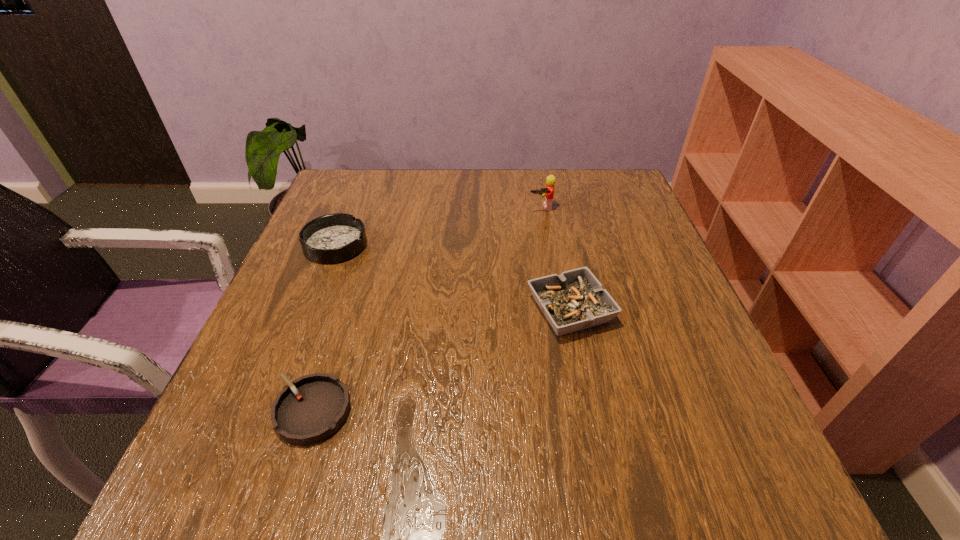
Identify the location of the tallest object. The width and height of the screenshot is (960, 540). (547, 192).

Find the location of a particular element. the farthest object is located at coordinates (547, 192).

The width and height of the screenshot is (960, 540). What are the coordinates of `the third nearest object` in the screenshot? It's located at (333, 238).

Identify the location of the rightmost ashtray. point(575,300).

This screenshot has height=540, width=960. I want to click on the second nearest object, so click(575, 300).

Locate an element on the screen. The height and width of the screenshot is (540, 960). the shortest object is located at coordinates (312, 408).

The image size is (960, 540). What are the coordinates of `the shortest ashtray` in the screenshot? It's located at (312, 408).

What are the coordinates of `vacant position located in front of the tallest object with the accessory visible` in the screenshot? It's located at (558, 294).

The height and width of the screenshot is (540, 960). What are the coordinates of `blank space located on the front of the second farthest object` in the screenshot? It's located at (293, 353).

Find the location of `free space located on the left of the rightmost ashtray`. free space located on the left of the rightmost ashtray is located at coordinates [450, 309].